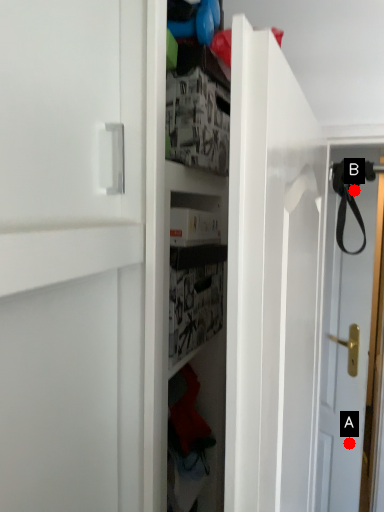
Question: Two points are circled on the image, labeled by A and B beside each circle. Among these points, which one is farthest from the camera?

Choices:
 (A) A is further
 (B) B is further

Answer: (A)